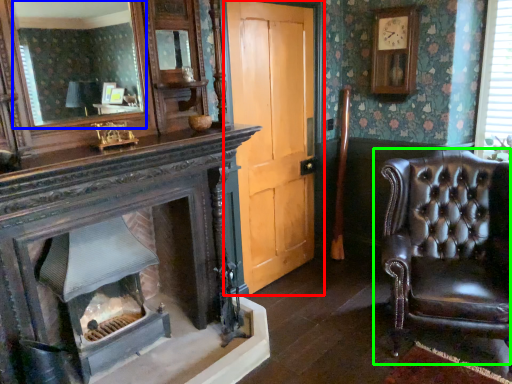
Question: Estimate the real-world distances between objects in this image. Which object is farther from door (highlighted by a red box), mirror (highlighted by a blue box) or chair (highlighted by a green box)?

Choices:
 (A) mirror
 (B) chair

Answer: (A)